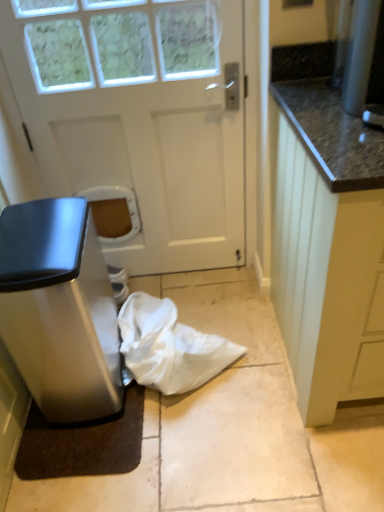
Describe the element at coordinates (169, 346) in the screenshot. I see `white fabric bag at lower center` at that location.

Measure the distance between white wood cabinet at right and camera.

The distance of white wood cabinet at right from camera is 31.76 inches.

At what (x,y) coordinates should I click in order to perform the action: click on white matte door at center. Please return your answer as a coordinate pair (x, y). Looking at the image, I should click on (137, 120).

Measure the distance from white fabric bag at lower center to satin silver trash can at left.

9.80 inches.

Does white fabric bag at lower center touch satin silver trash can at left?

No, white fabric bag at lower center is not making contact with satin silver trash can at left.

Is point (185, 359) positioned in front of point (60, 237)?

No.

Find the location of a particular element. This screenshot has width=384, height=512. material on the right of satin silver trash can at left is located at coordinates (169, 346).

Is satin silver trash can at left wider than white fabric bag at lower center?

Yes.

Is the depth of satin silver trash can at left greater than that of white fabric bag at lower center?

No, satin silver trash can at left is closer to the viewer.

Is point (76, 305) behind point (237, 346)?

No, (76, 305) is in front of (237, 346).

Where is `door on the left of the white wood cabinet at right`? The image size is (384, 512). door on the left of the white wood cabinet at right is located at coordinates (137, 120).

From the image's perspective, between white matte door at center and white wood cabinet at right, which one is located above?

white matte door at center appears higher in the image.

Does white matte door at center touch white wood cabinet at right?

No, white matte door at center is not next to white wood cabinet at right.

Can we say white matte door at center lies outside white wood cabinet at right?

Absolutely, white matte door at center is external to white wood cabinet at right.

Is white wood cabinet at right inside the boundaries of white fabric bag at lower center, or outside?

white wood cabinet at right cannot be found inside white fabric bag at lower center.

In terms of width, does white wood cabinet at right look wider or thinner when compared to white fabric bag at lower center?

Clearly, white wood cabinet at right has more width compared to white fabric bag at lower center.

Is the position of white wood cabinet at right less distant than that of white fabric bag at lower center?

Yes, it is in front of white fabric bag at lower center.

Looking at the image, does white wood cabinet at right seem bigger or smaller compared to white fabric bag at lower center?

white wood cabinet at right is bigger than white fabric bag at lower center.

Could you tell me if white matte door at center is turned towards white fabric bag at lower center?

Yes, white matte door at center is aimed at white fabric bag at lower center.

Can we say white matte door at center lies outside white fabric bag at lower center?

Indeed, white matte door at center is completely outside white fabric bag at lower center.

Considering the sizes of white matte door at center and white fabric bag at lower center in the image, is white matte door at center wider or thinner than white fabric bag at lower center?

Considering their sizes, white matte door at center looks slimmer than white fabric bag at lower center.

Are white matte door at center and white fabric bag at lower center beside each other?

No, white matte door at center is not next to white fabric bag at lower center.

Identify the location of door above the white fabric bag at lower center (from a real-world perspective). This screenshot has width=384, height=512. (137, 120).

Which object is closer to the camera taking this photo, white fabric bag at lower center or white matte door at center?

white matte door at center is closer to the camera.

Between point (157, 313) and point (98, 106), which one is positioned behind?

Point (157, 313)

From the image's perspective, which is below, white fabric bag at lower center or white matte door at center?

From the image's view, white fabric bag at lower center is below.

Between white matte door at center and satin silver trash can at left, which one has smaller size?

satin silver trash can at left.

Is white matte door at center aimed at satin silver trash can at left?

Yes, white matte door at center is turned towards satin silver trash can at left.

In terms of width, does white matte door at center look wider or thinner when compared to satin silver trash can at left?

Considering their sizes, white matte door at center looks slimmer than satin silver trash can at left.

Where is `home appliance that is above the white fabric bag at lower center (from a real-world perspective)`? The width and height of the screenshot is (384, 512). home appliance that is above the white fabric bag at lower center (from a real-world perspective) is located at coordinates (59, 311).

This screenshot has width=384, height=512. Identify the location of home appliance on the left of the white fabric bag at lower center. (59, 311).

When comparing their distances from white matte door at center, does white wood cabinet at right or white fabric bag at lower center seem closer?

Based on the image, white fabric bag at lower center appears to be nearer to white matte door at center.

Considering their positions, is satin silver trash can at left positioned closer to white matte door at center than white fabric bag at lower center?

The object closer to white matte door at center is satin silver trash can at left.

Looking at the image, which one is located further to white matte door at center, white fabric bag at lower center or satin silver trash can at left?

white fabric bag at lower center.

Looking at the image, which one is located closer to white fabric bag at lower center, white wood cabinet at right or satin silver trash can at left?

satin silver trash can at left is positioned closer to the anchor white fabric bag at lower center.

Estimate the real-world distances between objects in this image. Which object is closer to white fabric bag at lower center, satin silver trash can at left or white wood cabinet at right?

Based on the image, satin silver trash can at left appears to be nearer to white fabric bag at lower center.

From the image, which object appears to be farther from satin silver trash can at left, white fabric bag at lower center or white wood cabinet at right?

Based on the image, white wood cabinet at right appears to be further to satin silver trash can at left.

From the image, which object appears to be farther from white matte door at center, white fabric bag at lower center or white wood cabinet at right?

Among the two, white wood cabinet at right is located further to white matte door at center.

Based on their spatial positions, is white fabric bag at lower center or white matte door at center further from satin silver trash can at left?

white matte door at center lies further to satin silver trash can at left than the other object.

I want to click on material located between white matte door at center and white wood cabinet at right in the left-right direction, so click(x=169, y=346).

Locate an element on the screen. This screenshot has width=384, height=512. material situated between satin silver trash can at left and white wood cabinet at right from left to right is located at coordinates (169, 346).

The height and width of the screenshot is (512, 384). I want to click on home appliance that lies between white matte door at center and white fabric bag at lower center from top to bottom, so click(x=59, y=311).

The width and height of the screenshot is (384, 512). Identify the location of door situated between satin silver trash can at left and white wood cabinet at right from left to right. (137, 120).